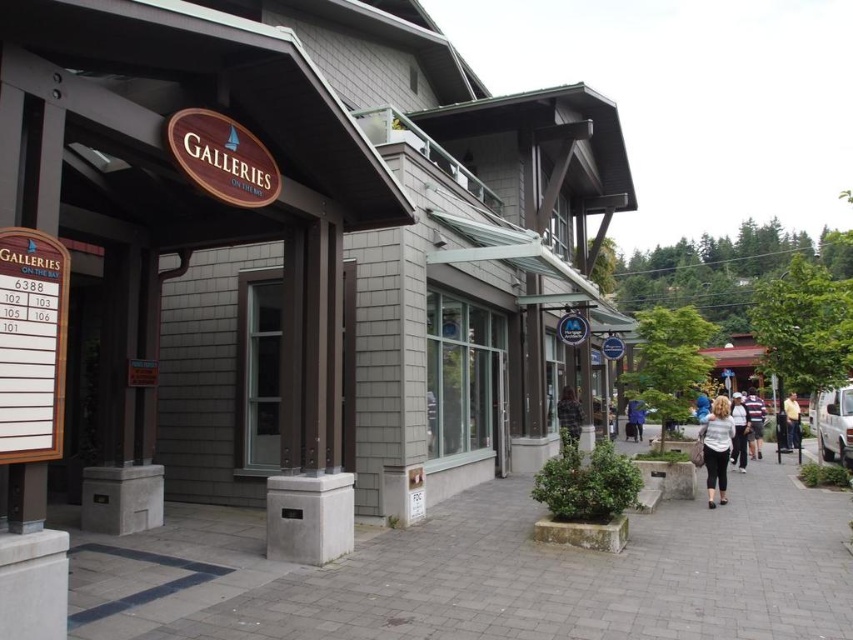
Question: In this image, where is gray concrete pavement at center located relative to blue denim jacket at center?

Choices:
 (A) below
 (B) above

Answer: (B)

Question: Which object is positioned farthest from the gray concrete pavement at center?

Choices:
 (A) blue denim jeans at center
 (B) white cotton shirt at center

Answer: (A)

Question: Where is gray concrete pavement at center located in relation to white matte shirt at center in the image?

Choices:
 (A) left
 (B) right

Answer: (A)

Question: Which of the following is the closest to the observer?

Choices:
 (A) pyautogui.click(x=704, y=413)
 (B) pyautogui.click(x=735, y=451)
 (C) pyautogui.click(x=726, y=477)

Answer: (C)

Question: Which point is closer to the camera?

Choices:
 (A) (500, 420)
 (B) (705, 442)

Answer: (B)

Question: Is light brown leather jacket at center to the left of blue denim jacket at center from the viewer's perspective?

Choices:
 (A) no
 (B) yes

Answer: (A)